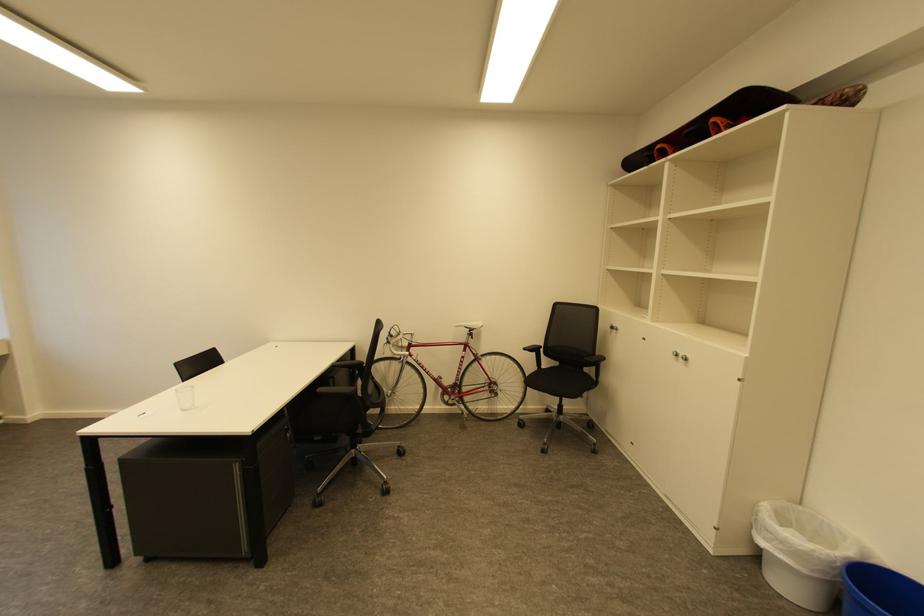
The image size is (924, 616). What do you see at coordinates (879, 591) in the screenshot? I see `the blue bucket` at bounding box center [879, 591].